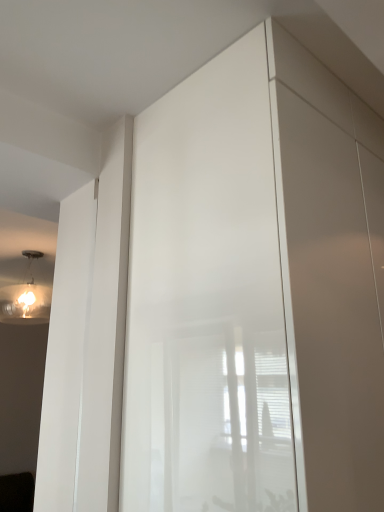
Question: Is matte white bulb at upper left outside of glossy white screen door at center?

Choices:
 (A) no
 (B) yes

Answer: (B)

Question: Is matte white bulb at upper left positioned in front of glossy white screen door at center?

Choices:
 (A) yes
 (B) no

Answer: (B)

Question: Is matte white bulb at upper left to the right of glossy white screen door at center from the viewer's perspective?

Choices:
 (A) yes
 (B) no

Answer: (B)

Question: Is matte white bulb at upper left oriented towards glossy white screen door at center?

Choices:
 (A) yes
 (B) no

Answer: (B)

Question: Is matte white bulb at upper left behind glossy white screen door at center?

Choices:
 (A) yes
 (B) no

Answer: (A)

Question: From the image's perspective, does matte white bulb at upper left appear lower than glossy white screen door at center?

Choices:
 (A) no
 (B) yes

Answer: (B)

Question: Does glossy white screen door at center appear on the left side of matte white bulb at upper left?

Choices:
 (A) yes
 (B) no

Answer: (B)

Question: Is glossy white screen door at center taller than matte white bulb at upper left?

Choices:
 (A) no
 (B) yes

Answer: (B)

Question: From a real-world perspective, is glossy white screen door at center physically above matte white bulb at upper left?

Choices:
 (A) no
 (B) yes

Answer: (A)

Question: From the image's perspective, does glossy white screen door at center appear higher than matte white bulb at upper left?

Choices:
 (A) yes
 (B) no

Answer: (A)

Question: Is glossy white screen door at center not near matte white bulb at upper left?

Choices:
 (A) yes
 (B) no

Answer: (A)

Question: Does glossy white screen door at center have a greater width compared to matte white bulb at upper left?

Choices:
 (A) yes
 (B) no

Answer: (A)

Question: Based on their sizes in the image, would you say glossy white screen door at center is bigger or smaller than matte white bulb at upper left?

Choices:
 (A) big
 (B) small

Answer: (A)